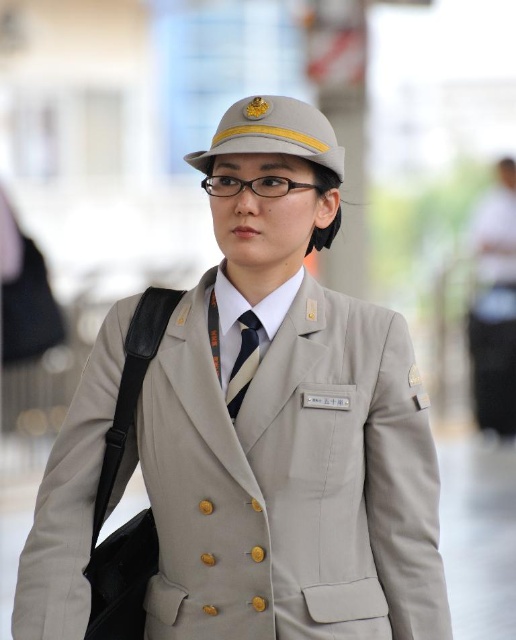
You are a tailor inspecting a uniform for alterations. You notice the beige uniform at center and the dark blue silk tie at center. Which item is positioned closer to the front of the person?

The beige uniform at center is in front of the dark blue silk tie at center, so the beige uniform at center is positioned closer to the front.

Please describe the position of the beige uniform at center in terms of coordinates.

The beige uniform at center is located at coordinates point (285, 420).